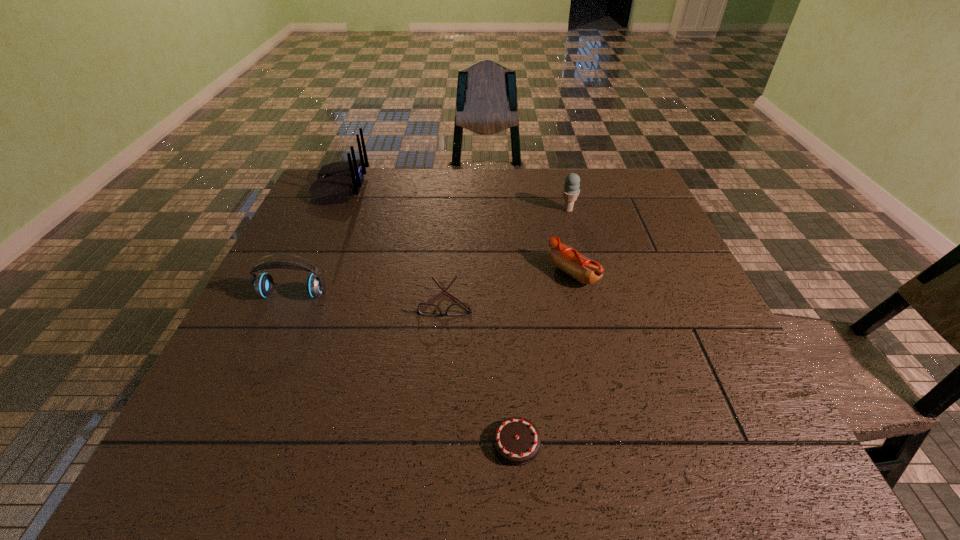
This screenshot has height=540, width=960. Find the location of `blank space that satisfies the following two spatial constraints: 1. on the back side of the chocolate cake; 2. on the left side of the ice cream`. blank space that satisfies the following two spatial constraints: 1. on the back side of the chocolate cake; 2. on the left side of the ice cream is located at coordinates (501, 210).

Find the location of `free space in the image that satisfies the following two spatial constraints: 1. on the back of the tallest object; 2. on the right side of the sausage`. free space in the image that satisfies the following two spatial constraints: 1. on the back of the tallest object; 2. on the right side of the sausage is located at coordinates (301, 273).

Find the location of a particular element. free space that satisfies the following two spatial constraints: 1. on the back of the ice cream; 2. on the left side of the tallest object is located at coordinates (330, 210).

Find the location of a particular element. free space in the image that satisfies the following two spatial constraints: 1. on the back side of the third shortest object; 2. on the left side of the ice cream is located at coordinates (558, 210).

At what (x,y) coordinates should I click in order to perform the action: click on vacant space that satisfies the following two spatial constraints: 1. on the front-facing side of the spectacles; 2. on the left side of the fourth object from left to right. Please return your answer as a coordinate pair (x, y). The image size is (960, 540). Looking at the image, I should click on (434, 443).